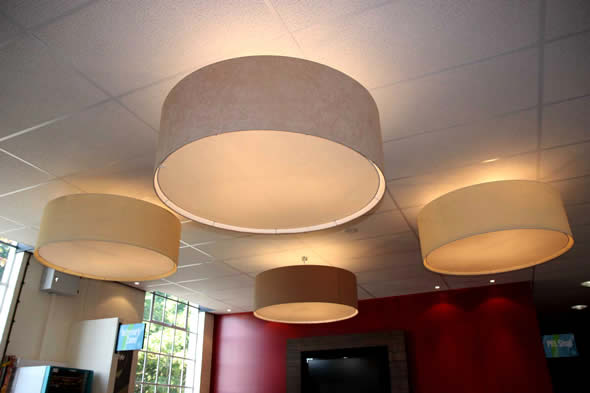
Where is `lighting`? lighting is located at coordinates (326, 296).